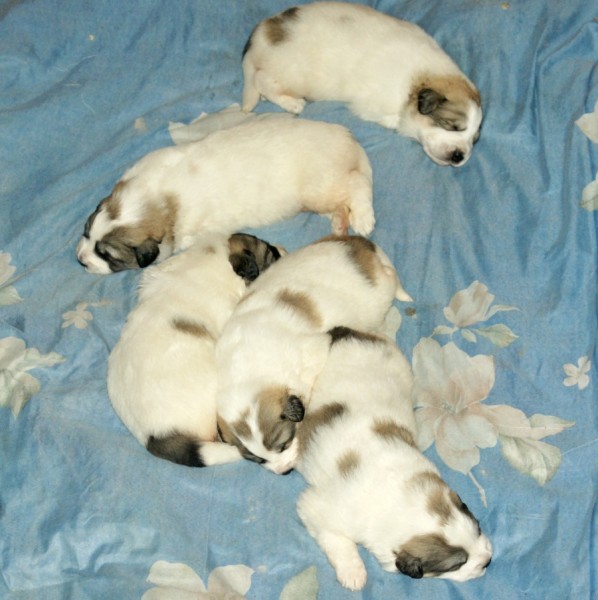
Where is `bed`? This screenshot has width=598, height=600. bed is located at coordinates (501, 247).